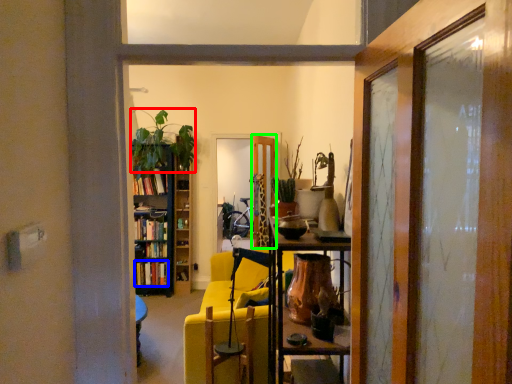
Question: Considering the real-world distances, which object is farthest from houseplant (highlighted by a red box)? book (highlighted by a blue box) or door (highlighted by a green box)?

Choices:
 (A) book
 (B) door

Answer: (A)